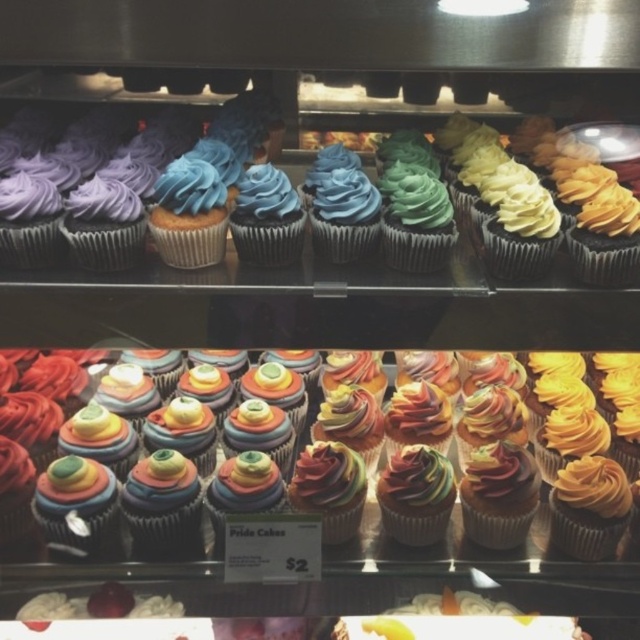
Which is behind, point (156, 176) or point (497, 536)?

Point (156, 176)

The width and height of the screenshot is (640, 640). In order to click on matte chocolate cupcake at center in this screenshot , I will do `click(243, 220)`.

Measure the distance between point (x=360, y=192) and camera.

Point (x=360, y=192) is 3.53 feet away from camera.

Locate an element on the screen. The image size is (640, 640). matte chocolate cupcake at center is located at coordinates (243, 220).